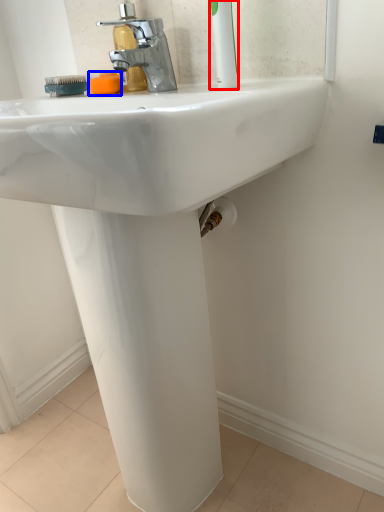
Question: Which of the following is the farthest to the observer, toothbrush (highlighted by a red box) or soap (highlighted by a blue box)?

Choices:
 (A) toothbrush
 (B) soap

Answer: (B)